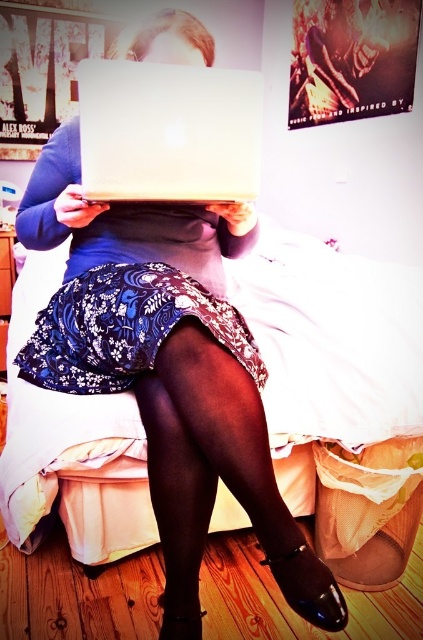
You are a delivery person who needs to place a small package on the floor near the black patent leather shoes at lower center. Where should you place the package?

The black patent leather shoes at lower center are located at point (219, 476), so you should place the package near that coordinate.

You are a delivery person who needs to place a small package on the floor between the black patent leather shoes at lower center and the white matte laptop at center. Can you fit the package there?

The black patent leather shoes at lower center is much taller than the white matte laptop at center. Since the shoes are taller, there might not be enough vertical space to place the package between them. However, since the objects are on the floor and the laptop is on a surface above, the package can be placed on the floor between them as vertical height isn

Looking at this image, you are a delivery robot trying to reach the white matte laptop at center on the bed. There is an obstacle blocking your path. Which direction should you move around to avoid the black patent leather shoes at lower center?

The black patent leather shoes at lower center are on the right side of the white matte laptop at center, so you should move around to the left side to avoid them.